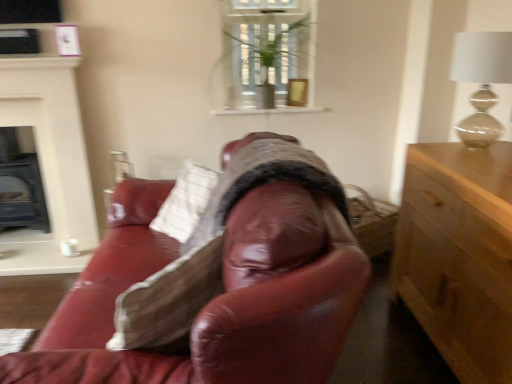
The width and height of the screenshot is (512, 384). What do you see at coordinates (264, 58) in the screenshot?
I see `green leafy plant at upper center` at bounding box center [264, 58].

This screenshot has height=384, width=512. In order to click on light wood cabinet at right in this screenshot , I will do `click(459, 255)`.

Describe the element at coordinates (459, 255) in the screenshot. Image resolution: width=512 pixels, height=384 pixels. I see `light wood cabinet at right` at that location.

Find the location of a particular element. matte black fireplace at left is located at coordinates (20, 183).

The image size is (512, 384). In order to click on white matte candle at left in this screenshot , I will do `click(69, 248)`.

In order to face white painted wood fireplace at left, should I rotate leftwards or rightwards?

Turn left by 27.719 degrees to look at white painted wood fireplace at left.

Find the location of `green leafy plant at upper center`. green leafy plant at upper center is located at coordinates (264, 58).

Based on their sizes in the image, would you say matte beige lamp at upper right is bigger or smaller than matte black fireplace at left?

In the image, matte beige lamp at upper right appears to be smaller than matte black fireplace at left.

From the image's perspective, which one is positioned lower, matte beige lamp at upper right or matte black fireplace at left?

From the image's view, matte black fireplace at left is below.

From a real-world perspective, does matte beige lamp at upper right sit lower than matte black fireplace at left?

Actually, matte beige lamp at upper right is physically above matte black fireplace at left in the real world.

From a real-world perspective, is matte black fireplace at left positioned under green leafy plant at upper center based on gravity?

Yes, from a real-world perspective, matte black fireplace at left is below green leafy plant at upper center.

Is matte black fireplace at left situated inside green leafy plant at upper center or outside?

matte black fireplace at left lies outside green leafy plant at upper center.

Is matte black fireplace at left far away from green leafy plant at upper center?

Absolutely, matte black fireplace at left is distant from green leafy plant at upper center.

Does matte black fireplace at left turn towards green leafy plant at upper center?

No, matte black fireplace at left does not turn towards green leafy plant at upper center.

From a real-world perspective, is green leafy plant at upper center beneath white matte candle at left?

No, from a real-world perspective, green leafy plant at upper center is not beneath white matte candle at left.

Could you tell me if green leafy plant at upper center is facing white matte candle at left?

No, green leafy plant at upper center is not oriented towards white matte candle at left.

Does point (288, 58) come farther from viewer compared to point (75, 242)?

No, (288, 58) is closer to viewer.

From the image's perspective, which is above, green leafy plant at upper center or white matte candle at left?

green leafy plant at upper center.

From the picture: From the image's perspective, does matte beige lamp at upper right appear lower than light wood cabinet at right?

No.

Can you confirm if matte beige lamp at upper right is positioned to the left of light wood cabinet at right?

Correct, you'll find matte beige lamp at upper right to the left of light wood cabinet at right.

Is matte beige lamp at upper right aimed at light wood cabinet at right?

No, matte beige lamp at upper right does not turn towards light wood cabinet at right.

Considering the relative sizes of matte beige lamp at upper right and light wood cabinet at right in the image provided, is matte beige lamp at upper right thinner than light wood cabinet at right?

Yes.

Is matte black fireplace at left turned away from white painted wood fireplace at left?

No, matte black fireplace at left's orientation is not away from white painted wood fireplace at left.

Can you confirm if matte black fireplace at left is wider than white painted wood fireplace at left?

Correct, the width of matte black fireplace at left exceeds that of white painted wood fireplace at left.

From a real-world perspective, who is located lower, matte black fireplace at left or white painted wood fireplace at left?

matte black fireplace at left.

From their relative heights in the image, would you say matte black fireplace at left is taller or shorter than white painted wood fireplace at left?

In the image, matte black fireplace at left appears to be shorter than white painted wood fireplace at left.

Is white painted wood fireplace at left closer to the viewer compared to matte black fireplace at left?

Yes, it is in front of matte black fireplace at left.

Is point (58, 85) closer to camera compared to point (4, 166)?

Yes, it is.

Could you tell me if white painted wood fireplace at left is facing matte black fireplace at left?

No, white painted wood fireplace at left is not turned towards matte black fireplace at left.

Are white painted wood fireplace at left and matte black fireplace at left beside each other?

No, white painted wood fireplace at left is not next to matte black fireplace at left.

Is the position of white matte candle at left more distant than that of matte black fireplace at left?

That is False.

Locate an element on the screen. candle that is under the matte black fireplace at left (from a real-world perspective) is located at coordinates (69, 248).

Considering the relative sizes of white matte candle at left and matte black fireplace at left in the image provided, is white matte candle at left smaller than matte black fireplace at left?

Correct, white matte candle at left occupies less space than matte black fireplace at left.

From the picture: Considering the relative sizes of white matte candle at left and matte black fireplace at left in the image provided, is white matte candle at left thinner than matte black fireplace at left?

Indeed, white matte candle at left has a lesser width compared to matte black fireplace at left.

At what (x,y) coordinates should I click in order to perform the action: click on lamp that is on the right side of matte black fireplace at left. Please return your answer as a coordinate pair (x, y). The width and height of the screenshot is (512, 384). Looking at the image, I should click on pyautogui.click(x=482, y=81).

Image resolution: width=512 pixels, height=384 pixels. In order to click on houseplant in front of the matte black fireplace at left in this screenshot , I will do `click(264, 58)`.

When comparing their distances from white painted wood fireplace at left, does matte beige lamp at upper right or light wood cabinet at right seem closer?

light wood cabinet at right is positioned closer to the anchor white painted wood fireplace at left.

Estimate the real-world distances between objects in this image. Which object is further from matte beige lamp at upper right, light wood cabinet at right or matte black fireplace at left?

Among the two, matte black fireplace at left is located further to matte beige lamp at upper right.

When comparing their distances from light wood cabinet at right, does white painted wood fireplace at left or matte beige lamp at upper right seem closer?

Based on the image, matte beige lamp at upper right appears to be nearer to light wood cabinet at right.

Which object lies nearer to the anchor point matte beige lamp at upper right, matte black fireplace at left or light wood cabinet at right?

light wood cabinet at right lies closer to matte beige lamp at upper right than the other object.

Which object lies nearer to the anchor point matte beige lamp at upper right, white painted wood fireplace at left or matte black fireplace at left?

Based on the image, white painted wood fireplace at left appears to be nearer to matte beige lamp at upper right.

Which object lies nearer to the anchor point light wood cabinet at right, white matte candle at left or green leafy plant at upper center?

Based on the image, green leafy plant at upper center appears to be nearer to light wood cabinet at right.

Considering their positions, is green leafy plant at upper center positioned further to light wood cabinet at right than white matte candle at left?

white matte candle at left.

Which object lies nearer to the anchor point white matte candle at left, matte beige lamp at upper right or green leafy plant at upper center?

green leafy plant at upper center lies closer to white matte candle at left than the other object.

What are the coordinates of `lamp located between matte black fireplace at left and light wood cabinet at right in the left-right direction` in the screenshot? It's located at (482, 81).

The width and height of the screenshot is (512, 384). In order to click on lamp situated between white painted wood fireplace at left and light wood cabinet at right from left to right in this screenshot , I will do `click(482, 81)`.

This screenshot has height=384, width=512. What are the coordinates of `candle between matte black fireplace at left and green leafy plant at upper center from left to right` in the screenshot? It's located at (69, 248).

The width and height of the screenshot is (512, 384). In order to click on candle situated between matte black fireplace at left and light wood cabinet at right from left to right in this screenshot , I will do `click(69, 248)`.